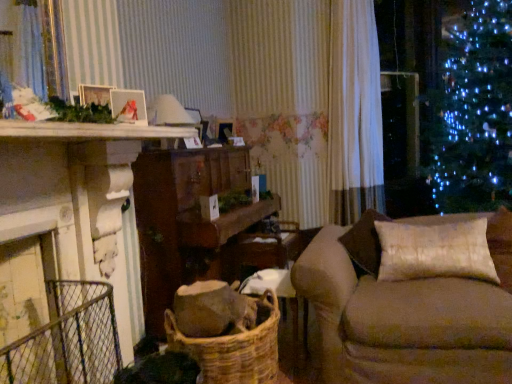
The height and width of the screenshot is (384, 512). What are the coordinates of `white sheer curtain at center` in the screenshot? It's located at (354, 113).

What do you see at coordinates (128, 106) in the screenshot? I see `metallic silver frame at upper left` at bounding box center [128, 106].

What do you see at coordinates (404, 315) in the screenshot? The width and height of the screenshot is (512, 384). I see `velvet beige couch at right` at bounding box center [404, 315].

What do you see at coordinates (234, 350) in the screenshot?
I see `woven brown basket at lower center` at bounding box center [234, 350].

This screenshot has height=384, width=512. What do you see at coordinates (189, 221) in the screenshot?
I see `wooden table at center` at bounding box center [189, 221].

This screenshot has height=384, width=512. In order to click on wooden table at center in this screenshot , I will do [189, 221].

The height and width of the screenshot is (384, 512). In order to click on white wooden mantle at upper left in this screenshot , I will do `click(89, 131)`.

Looking at this image, looking at the image, does satin beige pillow at right seem bigger or smaller compared to woven brown basket at lower center?

satin beige pillow at right is smaller than woven brown basket at lower center.

How far apart are satin beige pillow at right and woven brown basket at lower center?

satin beige pillow at right is 34.40 inches away from woven brown basket at lower center.

Does satin beige pillow at right have a greater width compared to woven brown basket at lower center?

In fact, satin beige pillow at right might be narrower than woven brown basket at lower center.

Does satin beige pillow at right turn towards woven brown basket at lower center?

No.

Is metallic silver frame at upper left bigger or smaller than white wooden mantle at upper left?

metallic silver frame at upper left is smaller than white wooden mantle at upper left.

From the image's perspective, is metallic silver frame at upper left located above or below white wooden mantle at upper left?

Based on their image positions, metallic silver frame at upper left is located above white wooden mantle at upper left.

Considering the sizes of metallic silver frame at upper left and white wooden mantle at upper left in the image, is metallic silver frame at upper left taller or shorter than white wooden mantle at upper left?

Result: metallic silver frame at upper left is taller than white wooden mantle at upper left.

From the picture: Which object is further away from the camera, white wooden mantle at upper left or wooden table at center?

wooden table at center is more distant.

Is white wooden mantle at upper left located outside wooden table at center?

white wooden mantle at upper left lies outside wooden table at center's area.

From a real-world perspective, is white wooden mantle at upper left over wooden table at center?

Indeed, from a real-world perspective, white wooden mantle at upper left stands above wooden table at center.

Is white wooden mantle at upper left taller or shorter than wooden table at center?

white wooden mantle at upper left is shorter than wooden table at center.

Between satin beige pillow at right and white sheer curtain at center, which one has larger width?

satin beige pillow at right.

Is point (466, 243) behind point (369, 51)?

No, (466, 243) is in front of (369, 51).

Considering the relative positions of satin beige pillow at right and white sheer curtain at center in the image provided, is satin beige pillow at right behind white sheer curtain at center?

No, satin beige pillow at right is closer to the viewer.

Which is more to the right, wooden table at center or satin beige pillow at right?

Positioned to the right is satin beige pillow at right.

Who is smaller, wooden table at center or satin beige pillow at right?

satin beige pillow at right is smaller.

Which is behind, point (182, 209) or point (387, 278)?

The point (182, 209) is farther from the camera.

Is wooden table at center taller than satin beige pillow at right?

Indeed, wooden table at center has a greater height compared to satin beige pillow at right.

Who is taller, metallic silver frame at upper left or white sheer curtain at center?

white sheer curtain at center.

From a real-world perspective, which object stands above the other?

In real-world perspective, white sheer curtain at center is above.

Is metallic silver frame at upper left oriented away from white sheer curtain at center?

No, white sheer curtain at center is not at the back of metallic silver frame at upper left.

How different are the orientations of metallic silver frame at upper left and white sheer curtain at center in degrees?

The angular difference between metallic silver frame at upper left and white sheer curtain at center is 26.7 degrees.

Is white sheer curtain at center positioned far away from satin beige pillow at right?

Yes, white sheer curtain at center and satin beige pillow at right are located far from each other.

Is white sheer curtain at center bigger than satin beige pillow at right?

A: Correct, white sheer curtain at center is larger in size than satin beige pillow at right.

In terms of width, does white sheer curtain at center look wider or thinner when compared to satin beige pillow at right?

Considering their sizes, white sheer curtain at center looks slimmer than satin beige pillow at right.

Based on the photo, from a real-world perspective, is white sheer curtain at center on satin beige pillow at right?

Yes, from a real-world perspective, white sheer curtain at center is above satin beige pillow at right.

Identify the location of basket below the satin beige pillow at right (from the image's perspective). (234, 350).

The height and width of the screenshot is (384, 512). I want to click on mantle that is under the metallic silver frame at upper left (from a real-world perspective), so click(89, 131).

From the image, which object appears to be nearer to velvet beige couch at right, metallic silver frame at upper left or woven brown basket at lower center?

Among the two, woven brown basket at lower center is located nearer to velvet beige couch at right.

Based on their spatial positions, is satin beige pillow at right or white wooden mantle at upper left further from woven brown basket at lower center?

white wooden mantle at upper left is positioned further to the anchor woven brown basket at lower center.

Which object lies nearer to the anchor point white wooden mantle at upper left, white sheer curtain at center or satin beige pillow at right?

satin beige pillow at right lies closer to white wooden mantle at upper left than the other object.

Estimate the real-world distances between objects in this image. Which object is further from woven brown basket at lower center, wooden table at center or satin beige pillow at right?

satin beige pillow at right is positioned further to the anchor woven brown basket at lower center.

Estimate the real-world distances between objects in this image. Which object is closer to satin beige pillow at right, white sheer curtain at center or woven brown basket at lower center?

woven brown basket at lower center is closer to satin beige pillow at right.

Considering their positions, is metallic silver frame at upper left positioned closer to velvet beige couch at right than wooden table at center?

wooden table at center is positioned closer to the anchor velvet beige couch at right.

Which object lies nearer to the anchor point white wooden mantle at upper left, metallic silver frame at upper left or velvet beige couch at right?

The object closer to white wooden mantle at upper left is metallic silver frame at upper left.

Based on their spatial positions, is white sheer curtain at center or velvet beige couch at right further from white wooden mantle at upper left?

The object further to white wooden mantle at upper left is white sheer curtain at center.

Find the location of `table between metallic silver frame at upper left and velvet beige couch at right`. table between metallic silver frame at upper left and velvet beige couch at right is located at coordinates (189, 221).

This screenshot has height=384, width=512. Identify the location of studio couch positioned between white wooden mantle at upper left and wooden table at center from near to far. (404, 315).

Identify the location of basket between white wooden mantle at upper left and velvet beige couch at right from left to right. (234, 350).

This screenshot has width=512, height=384. I want to click on table positioned between woven brown basket at lower center and white sheer curtain at center from near to far, so click(189, 221).